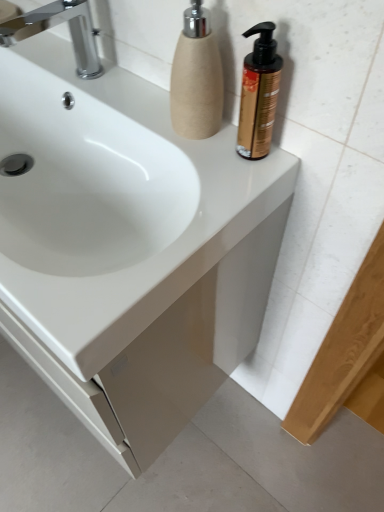
Locate an element on the screen. vacant space that is in between chrome metallic faucet at upper left and gold metallic pump bottle at upper right, the first soap dispenser in the right-to-left sequence is located at coordinates (138, 104).